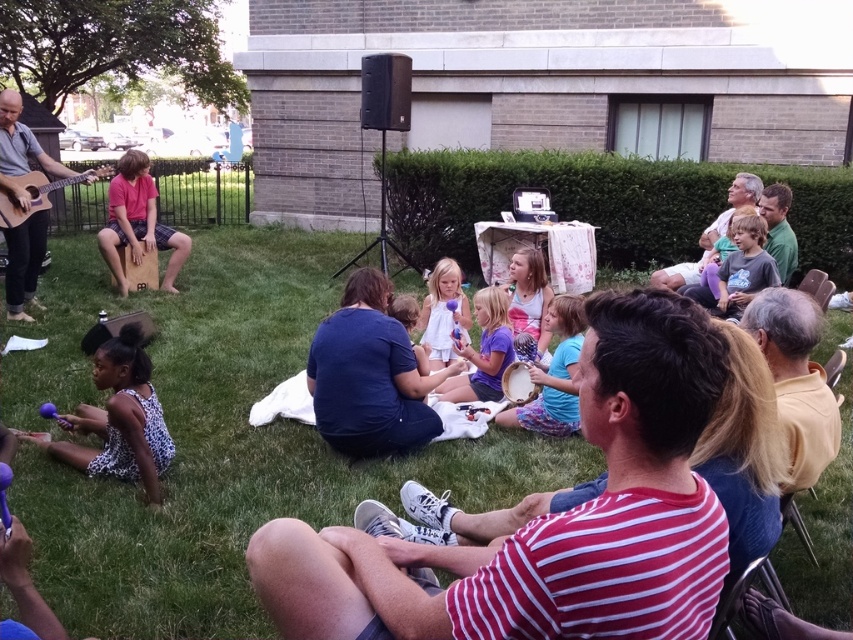
You are organizing a small gathering on the lawn and need to ensure there is enough space between the two white items at the center. The matte white dress at center and the white cotton shirt at center are both placed on the grass. If your rule requires at least 20 inches between items, will the current spacing meet your requirement?

The matte white dress at center and white cotton shirt at center are 19.04 inches apart, which is less than the required 20 inches. Therefore, the current spacing does not meet the requirement.

You are organizing a costume party and need to decide which outfit to choose. The spotted fabric dress at lower left and the dark gray shirt at center are your options. Which one is bigger?

The spotted fabric dress at lower left is larger in size than the dark gray shirt at center, so you should choose the spotted fabric dress at lower left for a bigger outfit.

You are organizing a small performance and need to ensure there is enough space between the two performers wearing the matte white dress at center and the white cotton shirt at center. If the minimum required space between them is 30 cm, and the dress is wider than the shirt, can you confirm if the current arrangement allows for this?

The matte white dress at center is wider than the white cotton shirt at center. However, the description does not provide specific measurements for either the width of the dress and shirt or the distance between them. Therefore, it is impossible to determine if the 30 cm spacing requirement is met without additional information.